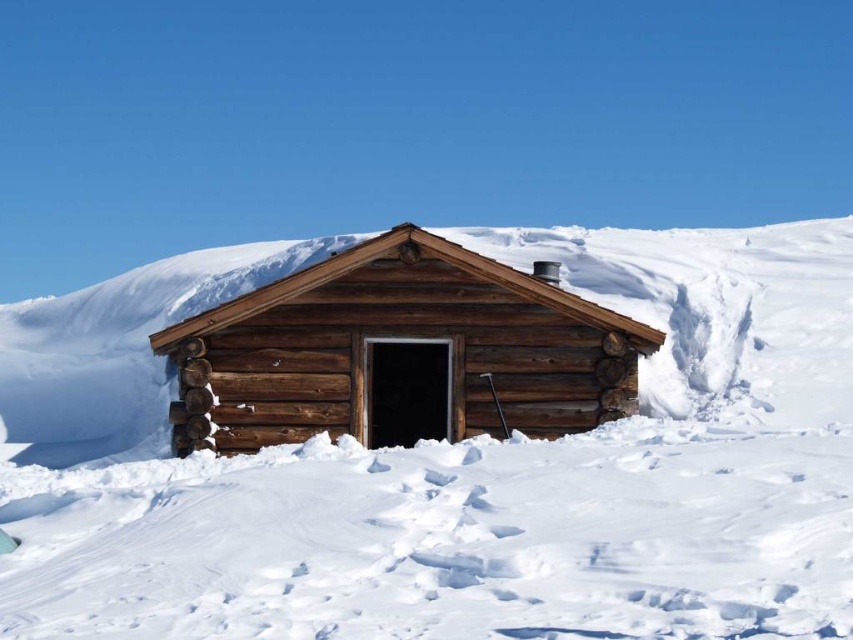
Is point (102, 588) closer to camera compared to point (459, 397)?

Yes.

Between point (721, 305) and point (370, 440), which one is positioned in front?

Point (370, 440) is more forward.

Where is `white fluffy snow at center`? white fluffy snow at center is located at coordinates (451, 467).